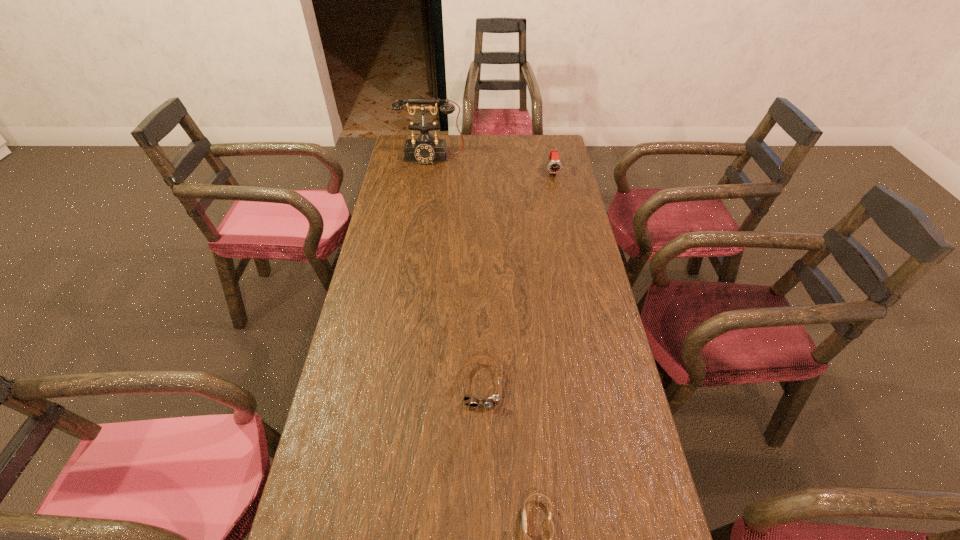
This screenshot has width=960, height=540. Identify the location of the leftmost object. (425, 149).

Find the location of a particular element. This screenshot has height=540, width=960. telephone is located at coordinates (425, 149).

Identify the location of the farther watch. (554, 166).

The width and height of the screenshot is (960, 540). I want to click on the second tallest object, so click(554, 166).

Identify the location of the second object from left to right. point(489,402).

Where is `the third farthest object`? the third farthest object is located at coordinates (489, 402).

Where is `blank space located 0.330m on the dial of the farthest object`? This screenshot has height=540, width=960. blank space located 0.330m on the dial of the farthest object is located at coordinates (422, 214).

This screenshot has width=960, height=540. I want to click on blank area located 0.270m on the face of the farther watch, so click(x=563, y=220).

The height and width of the screenshot is (540, 960). Find the location of `free spot located on the front-facing side of the second object from left to right`. free spot located on the front-facing side of the second object from left to right is located at coordinates (482, 484).

The height and width of the screenshot is (540, 960). Find the location of `object that is at the far edge`. object that is at the far edge is located at coordinates (425, 149).